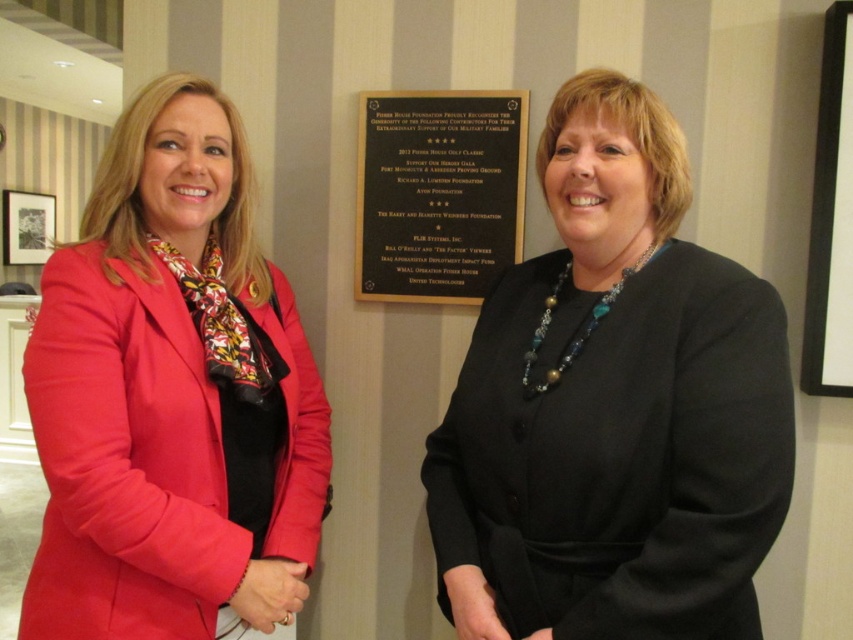
Question: Which object is positioned farthest from the black matte blazer at center?

Choices:
 (A) white glossy board at upper right
 (B) gold metallic plaque at center

Answer: (A)

Question: Is black matte blazer at center smaller than white glossy board at upper right?

Choices:
 (A) no
 (B) yes

Answer: (A)

Question: Among these objects, which one is farthest from the camera?

Choices:
 (A) matte pink blazer at left
 (B) black matte blazer at center

Answer: (A)

Question: Which object appears closest to the camera in this image?

Choices:
 (A) black matte blazer at center
 (B) gold metallic plaque at center

Answer: (A)

Question: Considering the relative positions of matte pink blazer at left and gold metallic plaque at center in the image provided, where is matte pink blazer at left located with respect to gold metallic plaque at center?

Choices:
 (A) left
 (B) right

Answer: (A)

Question: Can you confirm if gold metallic plaque at center is positioned to the right of white glossy board at upper right?

Choices:
 (A) yes
 (B) no

Answer: (B)